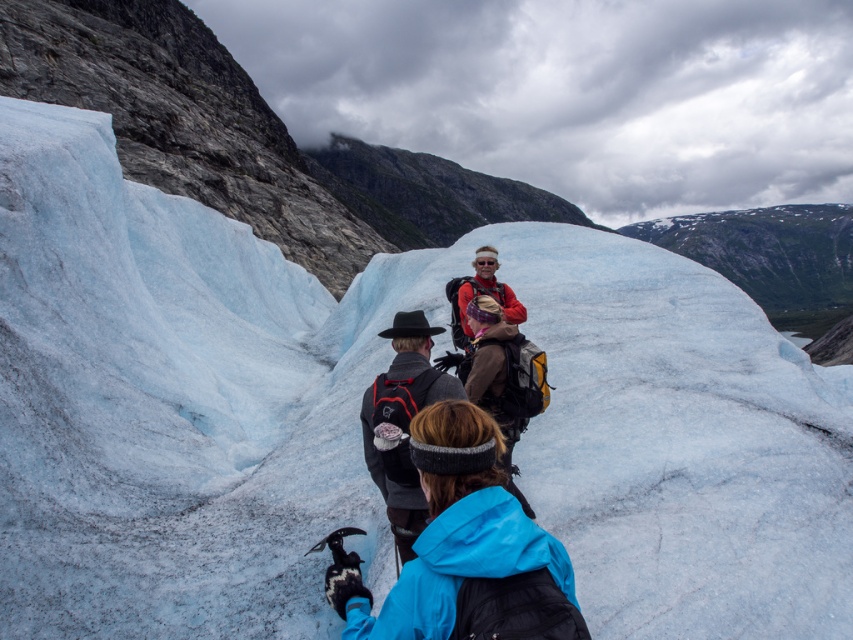
You are a photographer aiming to capture the group of people on the glacier. You notice a specific point at coordinates (451, 532) in the image. Which person is this point located on?

The point at coordinates (451, 532) is on the blue synthetic jacket at center.

You are a photographer trying to capture the dark gray wool hat at center in your shot. Given that your camera has a focal point at coordinates 0.5, 0.5, will the hat be in the center of your photo?

The dark gray wool hat at center is located at point (403, 420), which is slightly to the right and below the camera focal point at (426, 320). Therefore, it will not be perfectly centered in the photo.

You are a photographer taking a picture of the glacier scene. You notice the dark gray wool hat at center and the matte red jacket at center in your frame. Which object should you adjust to ensure both are fully visible in the photo?

You should adjust the dark gray wool hat at center because it is positioned under the matte red jacket at center and might be blocked from view.